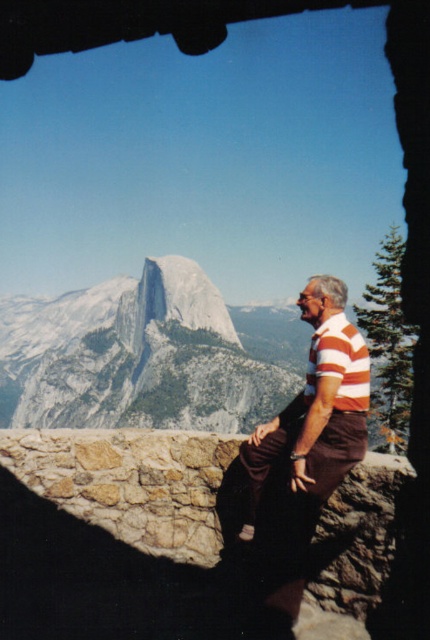
Which of these two, striped cotton shirt at right or orange striped polo shirt at center, stands shorter?

orange striped polo shirt at center

Is striped cotton shirt at right further to camera compared to orange striped polo shirt at center?

That is False.

Locate an element on the screen. This screenshot has height=640, width=430. striped cotton shirt at right is located at coordinates (316, 406).